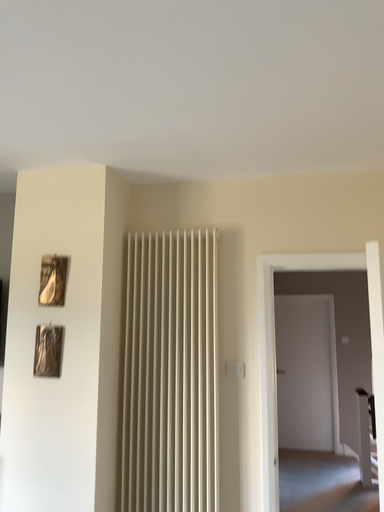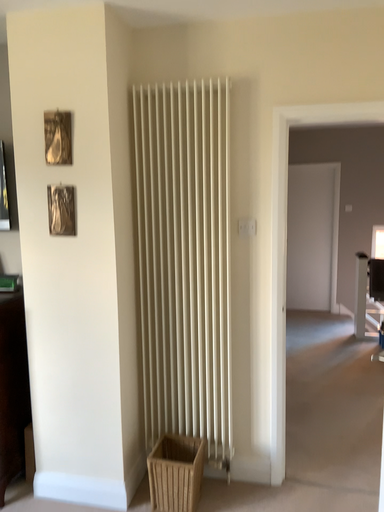
Question: Which way did the camera rotate in the video?

Choices:
 (A) rotated upward
 (B) rotated downward

Answer: (B)